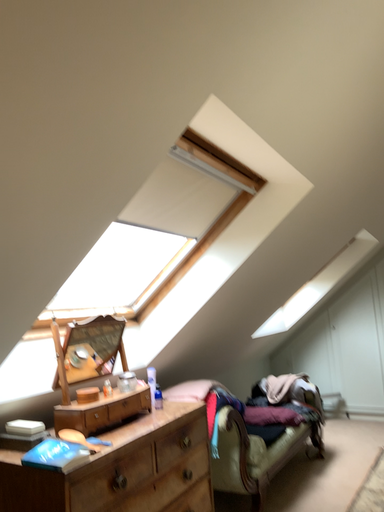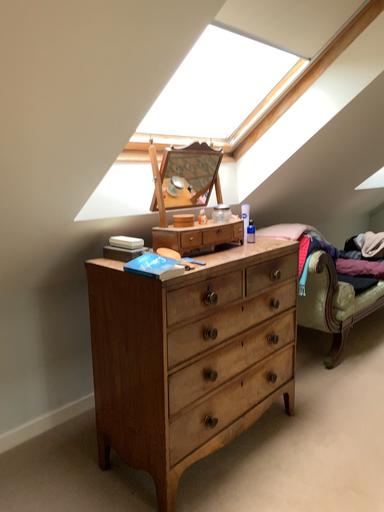
Question: How did the camera likely rotate when shooting the video?

Choices:
 (A) rotated upward
 (B) rotated downward

Answer: (B)